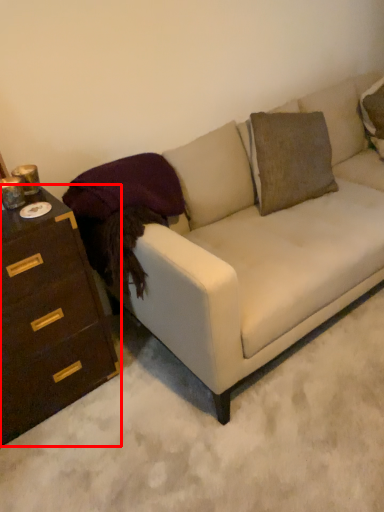
Question: In this image, where is chest of drawers (annotated by the red box) located relative to studio couch?

Choices:
 (A) left
 (B) right

Answer: (A)